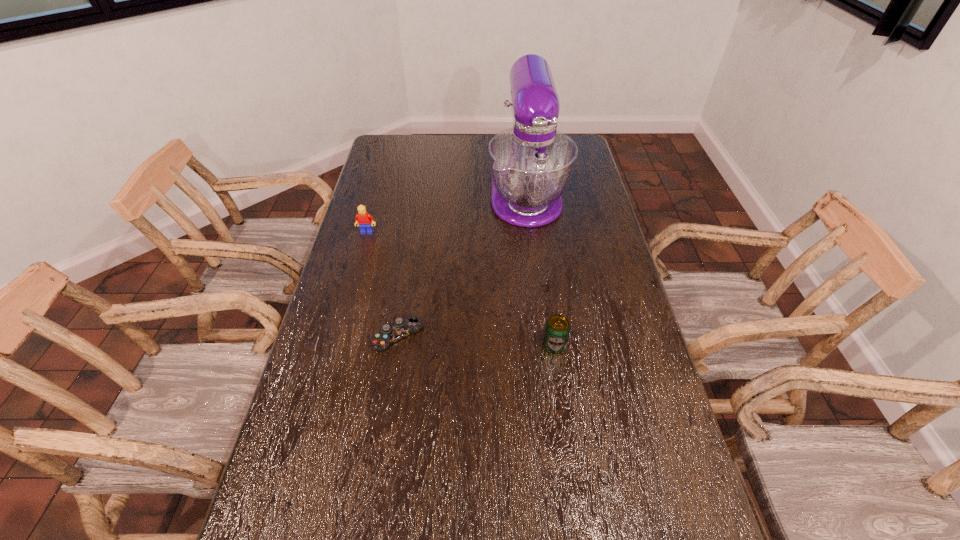
Where is `free space between the tallest object and the second object from left to right`? The height and width of the screenshot is (540, 960). free space between the tallest object and the second object from left to right is located at coordinates (462, 265).

This screenshot has width=960, height=540. Find the location of `vacant point located between the beer can and the mixer`. vacant point located between the beer can and the mixer is located at coordinates (540, 270).

The height and width of the screenshot is (540, 960). Find the location of `vacant area that lies between the control and the tallest object`. vacant area that lies between the control and the tallest object is located at coordinates (462, 265).

This screenshot has height=540, width=960. In order to click on free spot between the Lego and the beer can in this screenshot , I will do `click(461, 289)`.

At what (x,y) coordinates should I click in order to perform the action: click on blank region between the tallest object and the third object from right to left. Please return your answer as a coordinate pair (x, y). Image resolution: width=960 pixels, height=540 pixels. Looking at the image, I should click on (462, 265).

You are a GUI agent. You are given a task and a screenshot of the screen. Output one action in this format:
    pyautogui.click(x=<x>, y=<y>)
    Task: Click on the free space between the leftmost object and the third tallest object
    This screenshot has height=540, width=960.
    Given the screenshot: What is the action you would take?
    pyautogui.click(x=461, y=289)

You are a GUI agent. You are given a task and a screenshot of the screen. Output one action in this format:
    pyautogui.click(x=<x>, y=<y>)
    Task: Click on the unoccupied area between the third object from right to left and the third tallest object
    
    Given the screenshot: What is the action you would take?
    pyautogui.click(x=476, y=340)

Select which object is the third closest to the shortest object. Please provide its 2D coordinates. Your answer should be formatted as a tuple, i.e. [(x, y)], where the tuple contains the x and y coordinates of a point satisfying the conditions above.

[(531, 164)]

Choose which object is the third nearest neighbor to the third object from right to left. Please provide its 2D coordinates. Your answer should be formatted as a tuple, i.e. [(x, y)], where the tuple contains the x and y coordinates of a point satisfying the conditions above.

[(531, 164)]

Locate an element on the screen. vacant space that satisfies the following two spatial constraints: 1. at the bowl opening of the mixer; 2. on the left side of the second shortest object is located at coordinates (544, 345).